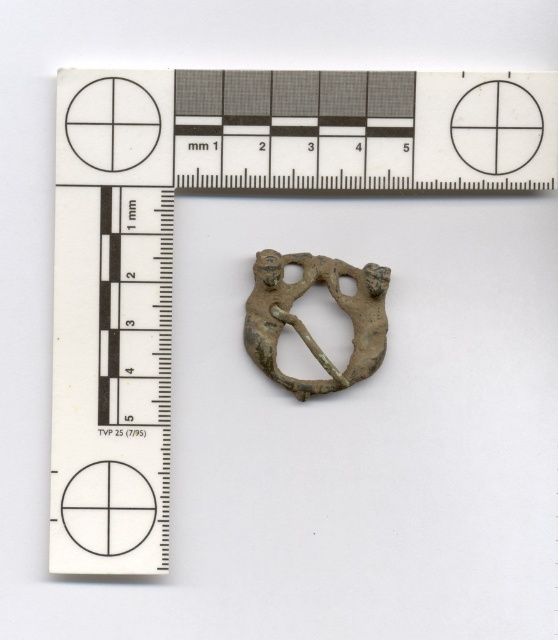
Can you confirm if metallic ruler at upper center is positioned to the left of matte white circle at upper left?

Incorrect, metallic ruler at upper center is not on the left side of matte white circle at upper left.

The image size is (558, 640). What do you see at coordinates (218, 188) in the screenshot?
I see `metallic ruler at upper center` at bounding box center [218, 188].

The width and height of the screenshot is (558, 640). In order to click on metallic ruler at upper center in this screenshot , I will do `click(218, 188)`.

Is matte black circle at lower left taller than matte white circle at upper left?

No.

Is point (90, 506) behind point (132, 134)?

No, (90, 506) is closer to viewer.

You are a GUI agent. You are given a task and a screenshot of the screen. Output one action in this format:
    pyautogui.click(x=<x>, y=<y>)
    Task: Click on the matte black circle at lower left
    The height and width of the screenshot is (640, 558).
    Given the screenshot: What is the action you would take?
    pyautogui.click(x=108, y=508)

Does point (89, 164) come in front of point (514, 170)?

Yes, it is in front of point (514, 170).

Between matte white circle at upper left and matte white circle at center, which one has more height?

Standing taller between the two is matte white circle at upper left.

Locate an element on the screen. matte white circle at upper left is located at coordinates (113, 124).